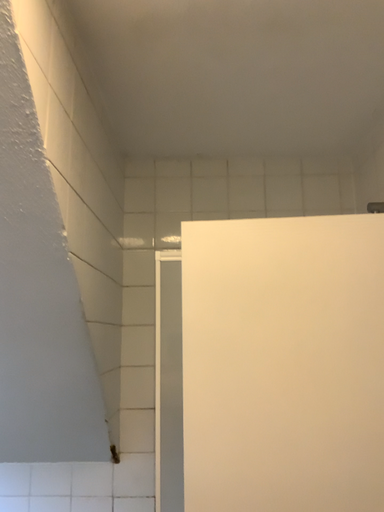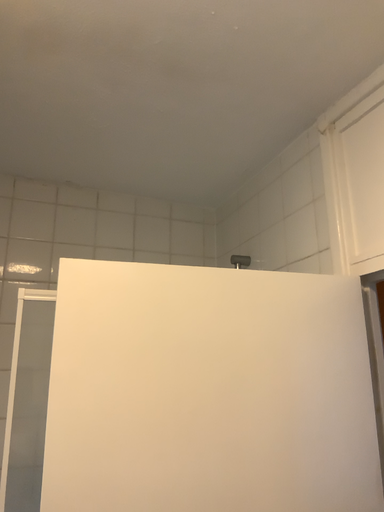
Question: Which way did the camera rotate in the video?

Choices:
 (A) rotated right
 (B) rotated left

Answer: (A)